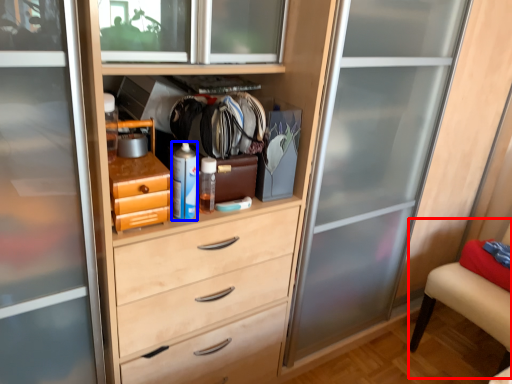
Question: Among these objects, which one is farthest to the camera, armchair (highlighted by a red box) or bottle (highlighted by a blue box)?

Choices:
 (A) armchair
 (B) bottle

Answer: (A)